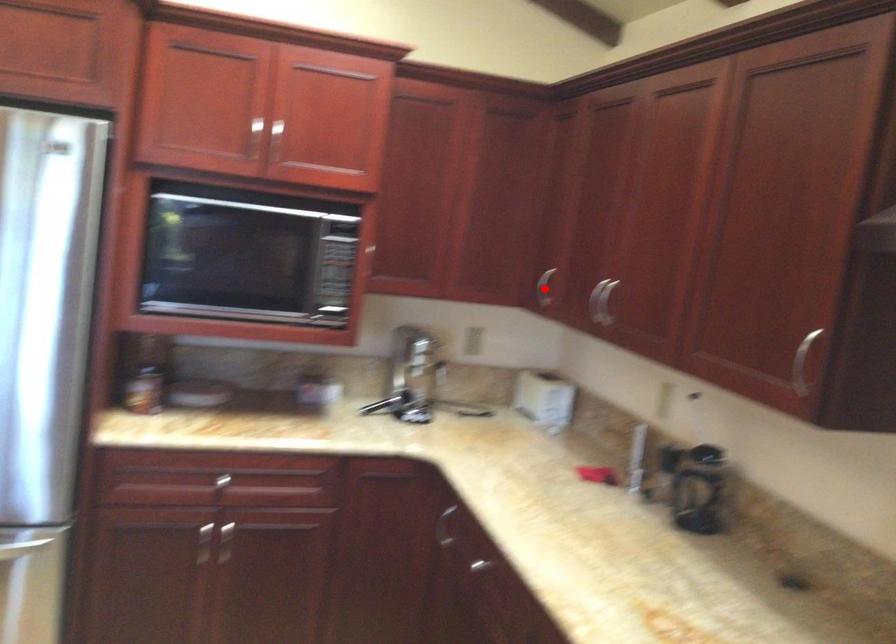
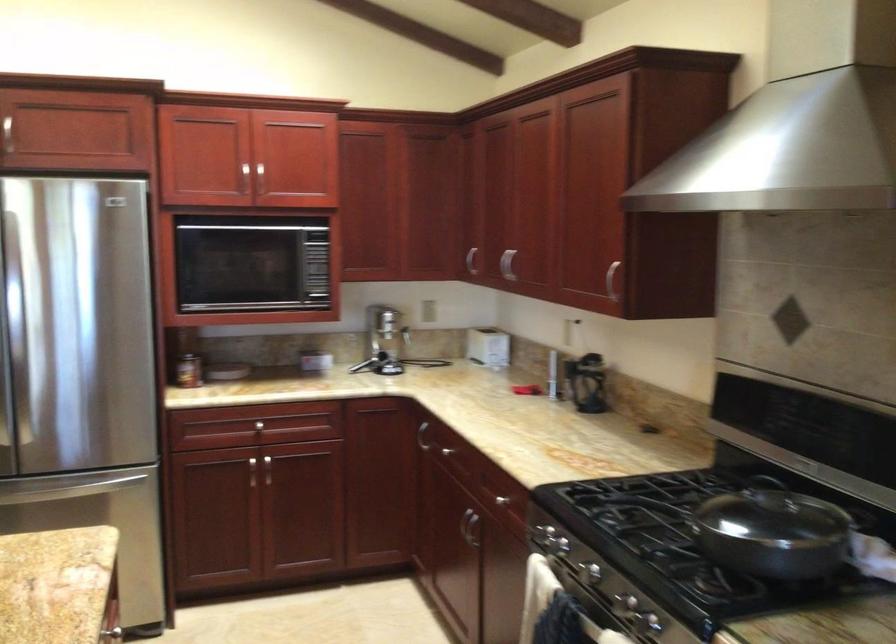
Question: I am providing you with two images of the same scene from different viewpoints. A red point is shown in image1. For the corresponding object point in image2, is it positioned nearer or farther from the camera?

Choices:
 (A) Nearer
 (B) Farther

Answer: (B)